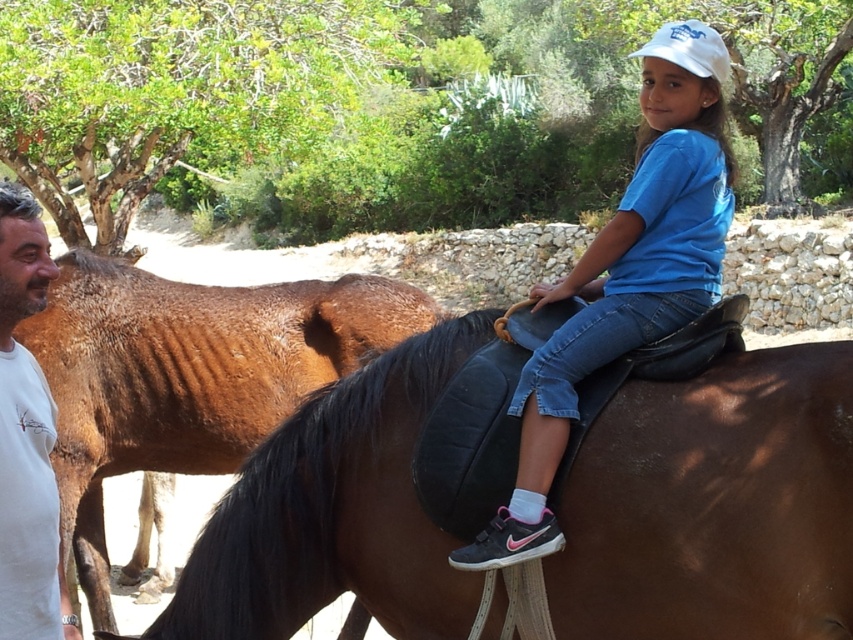
You are a photographer trying to capture the girl riding the horse. You notice a point at coordinates (714, 506) on your camera screen. What object is located at this point?

The point at coordinates (714, 506) marks the brown leather saddle at upper center.

You are a photographer trying to capture the girl and her horse. You notice the brown leather saddle at upper center and the blue cotton shirt at center. Which object should you focus on first if you want to photograph the one that is positioned to the right?

The blue cotton shirt at center should be focused on first because the brown leather saddle at upper center is to the left of it, making the blue cotton shirt at center positioned to the right.

What are the coordinates of the brown shiny horse at left?

The brown shiny horse at left is located at coordinates point (189, 374).